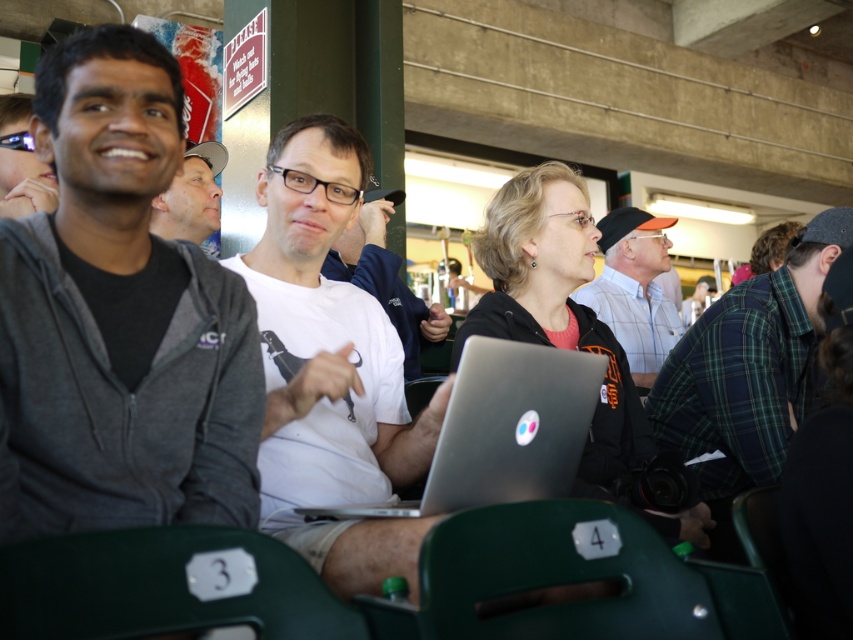
Question: Which of the following is the closest to the observer?

Choices:
 (A) silver metallic laptop at center
 (B) white shirt at center
 (C) green plaid shirt at right
 (D) matte white shirt at center

Answer: (A)

Question: Is dark gray zip-up hoodie at left smaller than white matte shirt at center?

Choices:
 (A) yes
 (B) no

Answer: (A)

Question: Which of these objects is positioned closest to the matte black glasses at upper left?

Choices:
 (A) matte white shirt at center
 (B) white matte t-shirt at center

Answer: (A)

Question: Where is green plaid shirt at right located in relation to silver metallic laptop at center in the image?

Choices:
 (A) below
 (B) above

Answer: (B)

Question: Can you confirm if white matte shirt at center is positioned to the right of matte white shirt at center?

Choices:
 (A) yes
 (B) no

Answer: (A)

Question: Which point is farther from the camera taking this photo?

Choices:
 (A) (570, 470)
 (B) (155, 212)

Answer: (B)